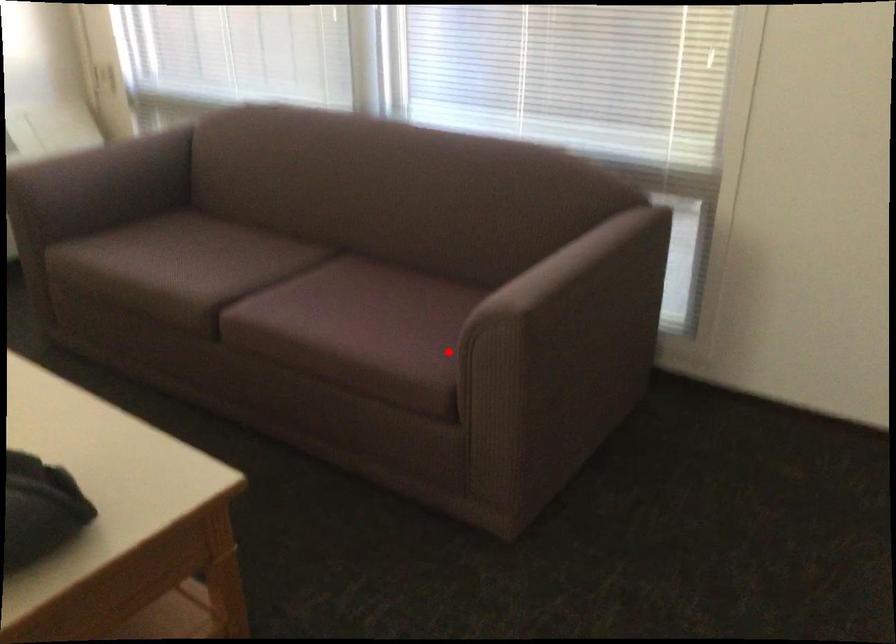
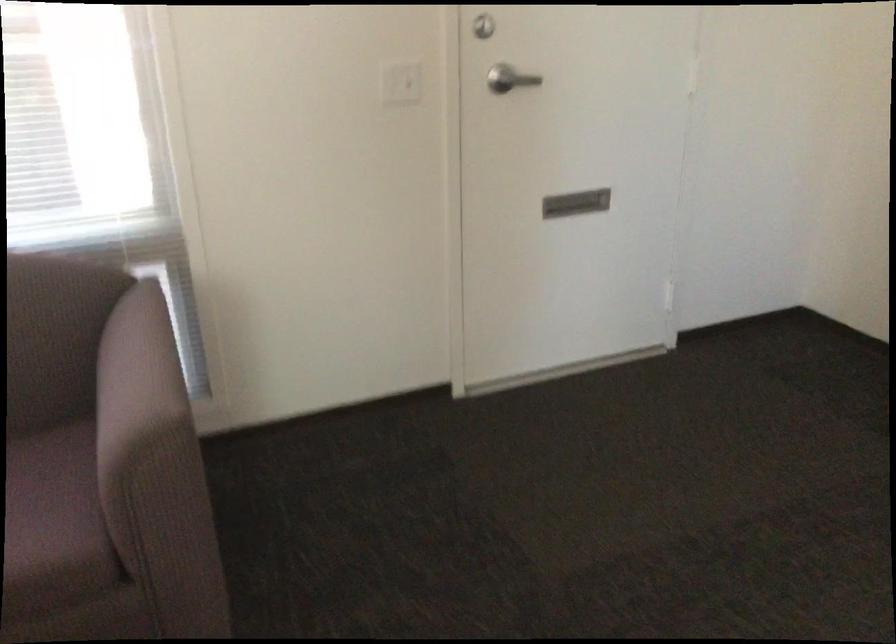
Question: I am providing you with two images of the same scene from different viewpoints. Given a red point in image1, look at the same physical point in image2. Is it:

Choices:
 (A) Closer to the viewpoint
 (B) Farther from the viewpoint

Answer: (A)